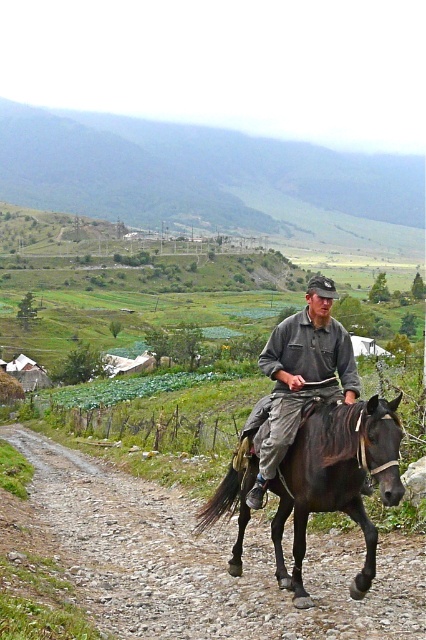
Between shiny black horse at center and gray cotton shirt at center, which one has more height?

With more height is gray cotton shirt at center.

Is point (331, 429) closer to viewer compared to point (268, 432)?

Yes, it is in front of point (268, 432).

Does point (293, 474) come closer to viewer compared to point (276, 330)?

Yes.

This screenshot has width=426, height=640. Identify the location of shiny black horse at center. (336, 477).

Which is more to the right, gravelly dirt track at center or shiny black horse at center?

From the viewer's perspective, shiny black horse at center appears more on the right side.

This screenshot has width=426, height=640. Describe the element at coordinates (207, 563) in the screenshot. I see `gravelly dirt track at center` at that location.

Identify the location of gravelly dirt track at center. (207, 563).

Which of these two, green grassy hillside at upper center or gray cotton shirt at center, stands taller?

green grassy hillside at upper center is taller.

In order to click on green grassy hillside at upper center in this screenshot , I will do `click(209, 179)`.

You are a GUI agent. You are given a task and a screenshot of the screen. Output one action in this format:
    pyautogui.click(x=<x>, y=<y>)
    Task: Click on the green grassy hillside at upper center
    This screenshot has height=640, width=426.
    Given the screenshot: What is the action you would take?
    pyautogui.click(x=209, y=179)